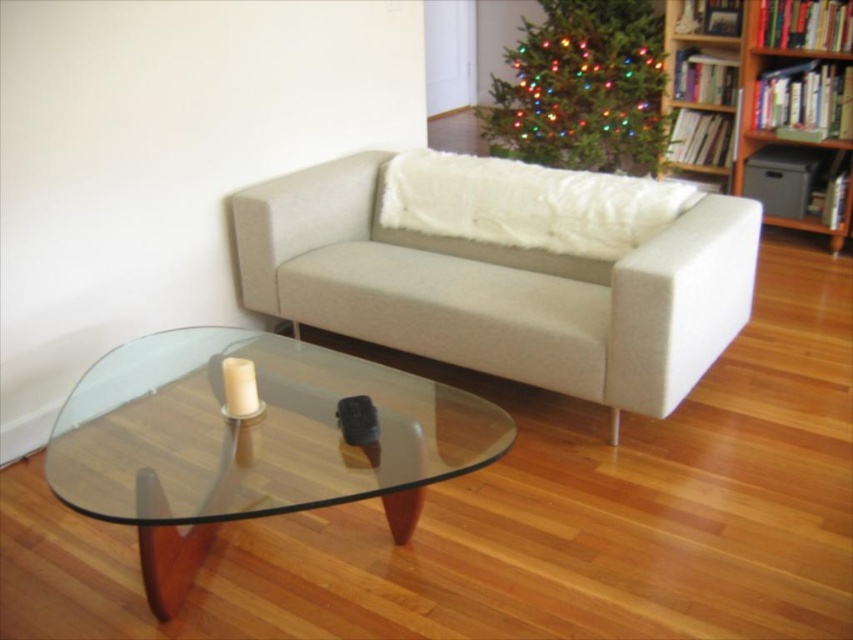
You are planning to place a large rectangular painting that is 1.5 meters wide between the beige fabric couch at center and the wooden bookshelf at upper right. Based on their widths, will the painting fit horizontally between them?

The beige fabric couch at center might be wider than wooden bookshelf at upper right, so it is uncertain whether the painting will fit. You should measure the space between them first.

You are a guest entering the living room and want to sit down. Which object should you approach first, the beige fabric couch at center or the multicolored lights christmas tree at upper center?

The beige fabric couch at center is positioned under the multicolored lights christmas tree at upper center, so you should approach the beige fabric couch at center first since it is lower and more accessible for sitting.

You are a delivery person needing to place a package between the beige fabric couch at center and the multicolored lights christmas tree at upper center. The package requires 1.5 meters of space. Can you fit it there?

The beige fabric couch at center is 1.51 meters away from the multicolored lights christmas tree at upper center, so yes, the package requiring 1.5 meters of space can fit between them since the distance is sufficient.